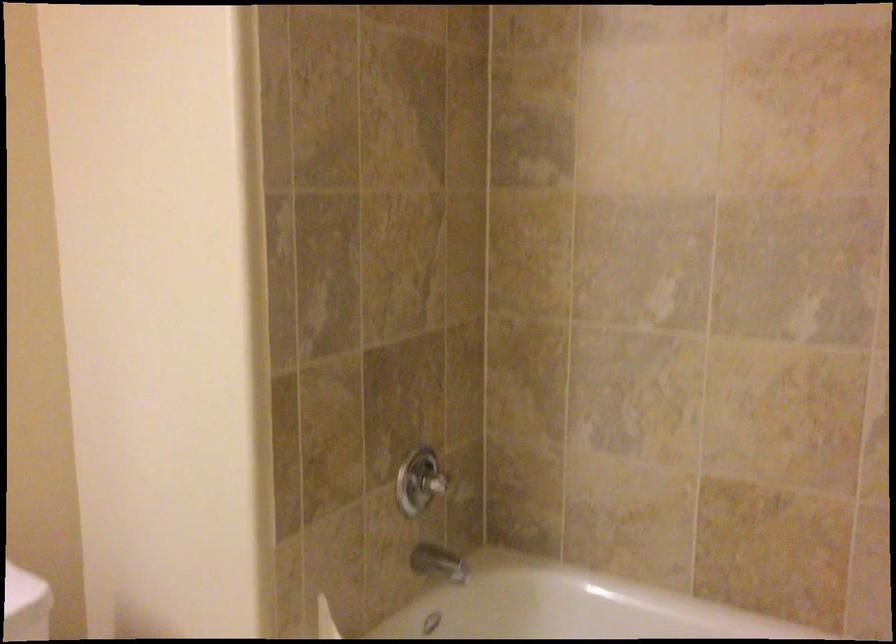
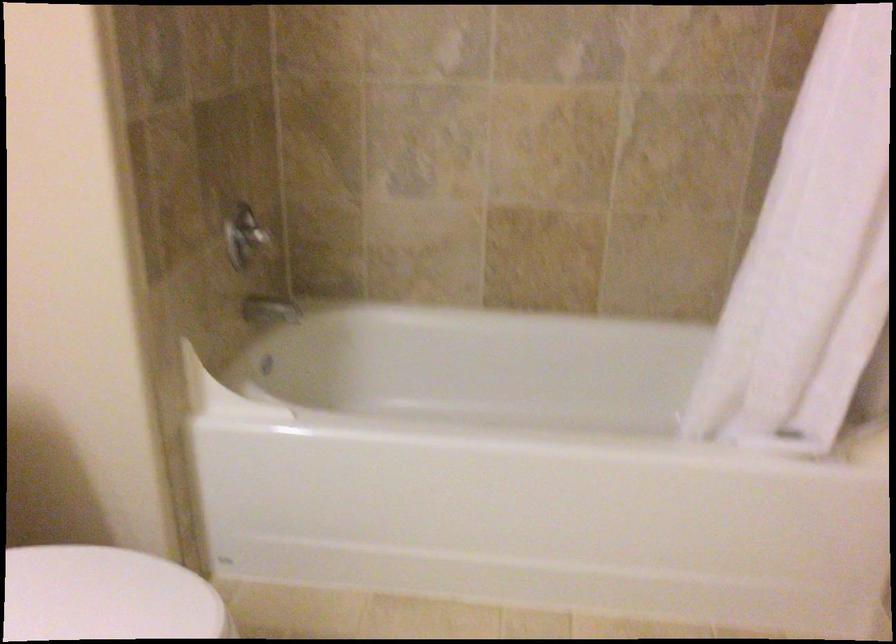
Question: The images are taken continuously from a first-person perspective. In which direction are you moving?

Choices:
 (A) Left
 (B) Right
 (C) Forward
 (D) Backward

Answer: (A)